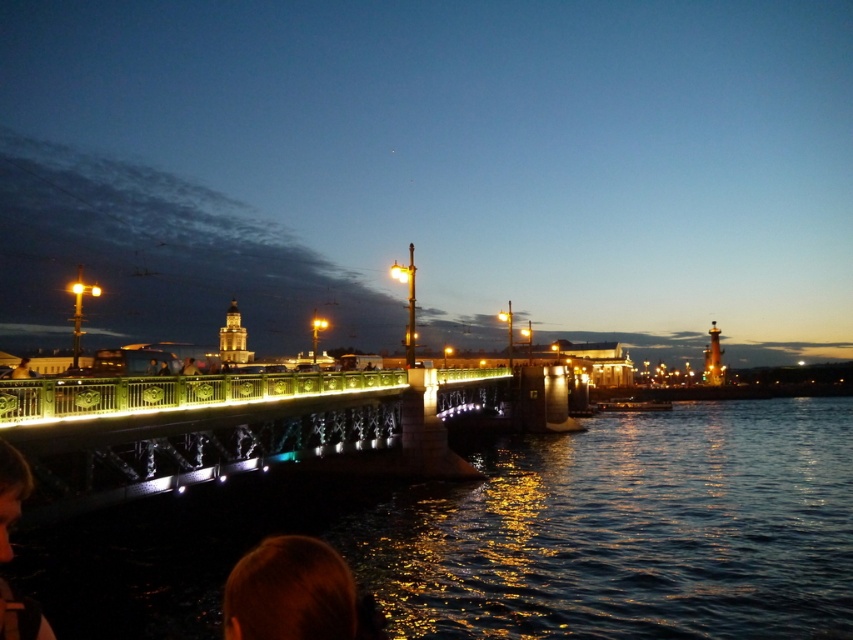
Is illuminated metal bridge at center above brown hair at lower center?

Indeed, illuminated metal bridge at center is positioned over brown hair at lower center.

Describe the element at coordinates (206, 454) in the screenshot. The image size is (853, 640). I see `illuminated metal bridge at center` at that location.

The height and width of the screenshot is (640, 853). Find the location of `illuminated metal bridge at center`. illuminated metal bridge at center is located at coordinates (206, 454).

Between illuminated metal bridge at center and light brown hair at lower left, which one has less height?

With less height is light brown hair at lower left.

Which is more to the left, illuminated metal bridge at center or light brown hair at lower left?

From the viewer's perspective, light brown hair at lower left appears more on the left side.

Locate an element on the screen. illuminated metal bridge at center is located at coordinates (206, 454).

Between point (283, 616) and point (13, 605), which one is positioned behind?

Point (283, 616)

Consider the image. Can you confirm if brown hair at lower center is positioned below light brown hair at lower left?

Yes.

This screenshot has height=640, width=853. What do you see at coordinates (289, 593) in the screenshot?
I see `brown hair at lower center` at bounding box center [289, 593].

I want to click on brown hair at lower center, so click(x=289, y=593).